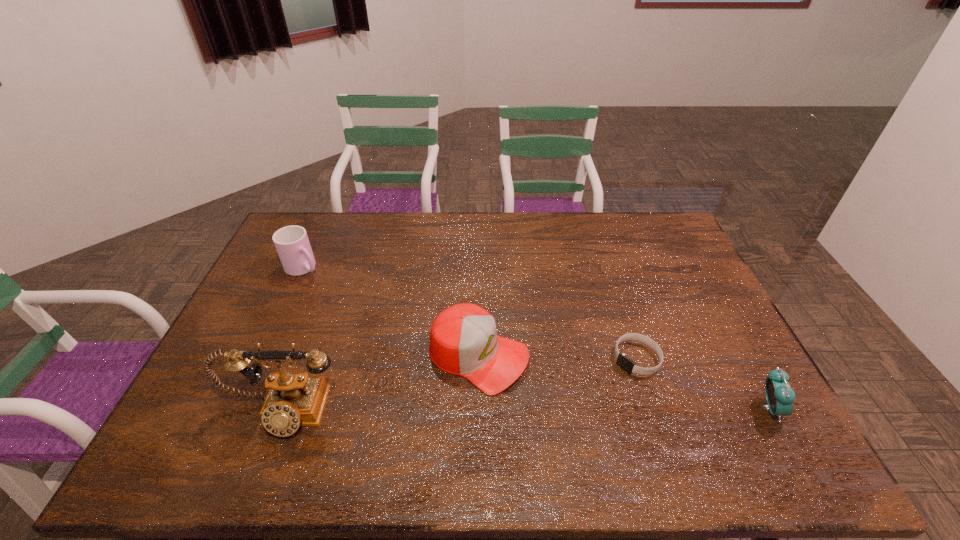
Locate an element on the screen. free space between the third object from right to left and the shortest object is located at coordinates (558, 357).

Locate an element on the screen. vacant space that is in between the wristband and the rightmost object is located at coordinates (703, 383).

Locate an element on the screen. The width and height of the screenshot is (960, 540). free area in between the rightmost object and the fourth object from left to right is located at coordinates (703, 383).

You are a GUI agent. You are given a task and a screenshot of the screen. Output one action in this format:
    pyautogui.click(x=<x>, y=<y>)
    Task: Click on the unoccupied area between the fourth object from left to right and the alarm clock
    
    Given the screenshot: What is the action you would take?
    pyautogui.click(x=703, y=383)

Find the location of a particular element. The height and width of the screenshot is (540, 960). free space between the rightmost object and the tallest object is located at coordinates (525, 410).

You are a GUI agent. You are given a task and a screenshot of the screen. Output one action in this format:
    pyautogui.click(x=<x>, y=<y>)
    Task: Click on the blank region between the alarm clock and the cup
    Image resolution: width=960 pixels, height=540 pixels.
    Given the screenshot: What is the action you would take?
    pyautogui.click(x=536, y=338)

What are the coordinates of `free space between the cup and the tallest object` in the screenshot? It's located at (292, 340).

This screenshot has width=960, height=540. Identify the location of vacant point located between the third object from left to right and the cup. (391, 312).

This screenshot has height=540, width=960. What are the coordinates of `object that is the second closest to the baseball cap` in the screenshot? It's located at (626, 363).

The height and width of the screenshot is (540, 960). Find the location of `object that is the third closest one to the cup`. object that is the third closest one to the cup is located at coordinates (626, 363).